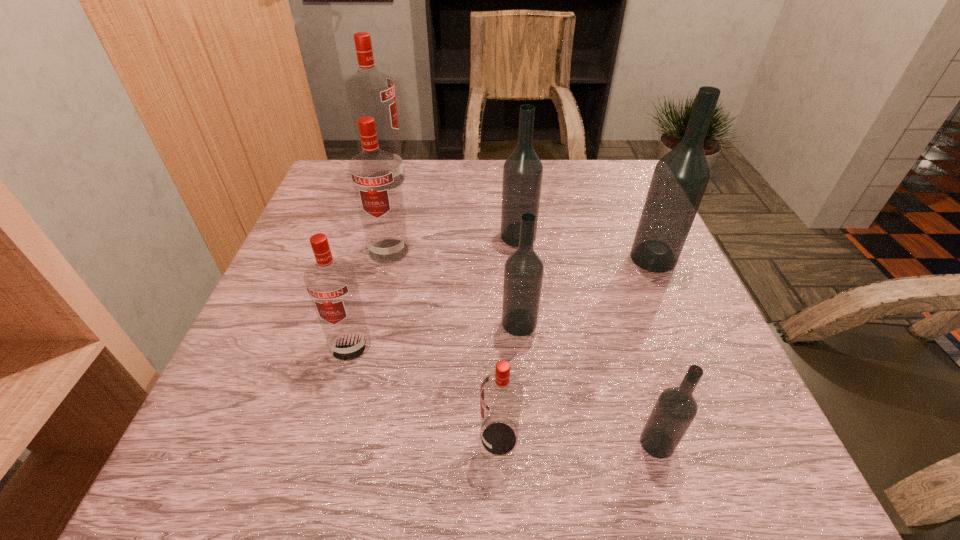
The height and width of the screenshot is (540, 960). Find the location of `free space at the far right corner`. free space at the far right corner is located at coordinates (584, 160).

Locate an element on the screen. vacant position at the near right corner of the desktop is located at coordinates (693, 491).

Where is `free space between the farthest vodka and the second biggest black vodka`? free space between the farthest vodka and the second biggest black vodka is located at coordinates (451, 208).

Find the location of a particular element. The height and width of the screenshot is (540, 960). blank region between the second nearest red vodka and the farthest red vodka is located at coordinates (368, 262).

Identify the location of vacant space in between the second farthest red vodka and the second biggest black vodka. The height and width of the screenshot is (540, 960). (453, 244).

This screenshot has width=960, height=540. I want to click on blank region between the smallest red vodka and the farthest red vodka, so click(442, 309).

Find the location of a particular element. Image resolution: width=960 pixels, height=540 pixels. empty space between the third farthest red vodka and the third farthest black vodka is located at coordinates (435, 334).

Image resolution: width=960 pixels, height=540 pixels. Identify the location of vacant region between the third biggest black vodka and the rightmost vodka. (587, 291).

In order to click on vacant space in between the second biggest black vodka and the third smallest red vodka in this screenshot , I will do `click(453, 244)`.

Identify the location of the seventh closest object to the farthest object. This screenshot has width=960, height=540. (675, 409).